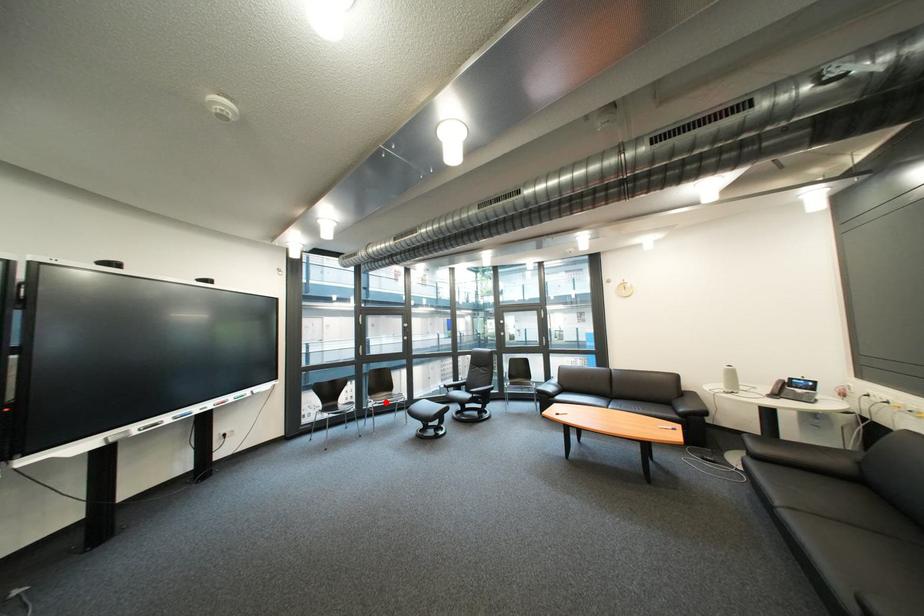
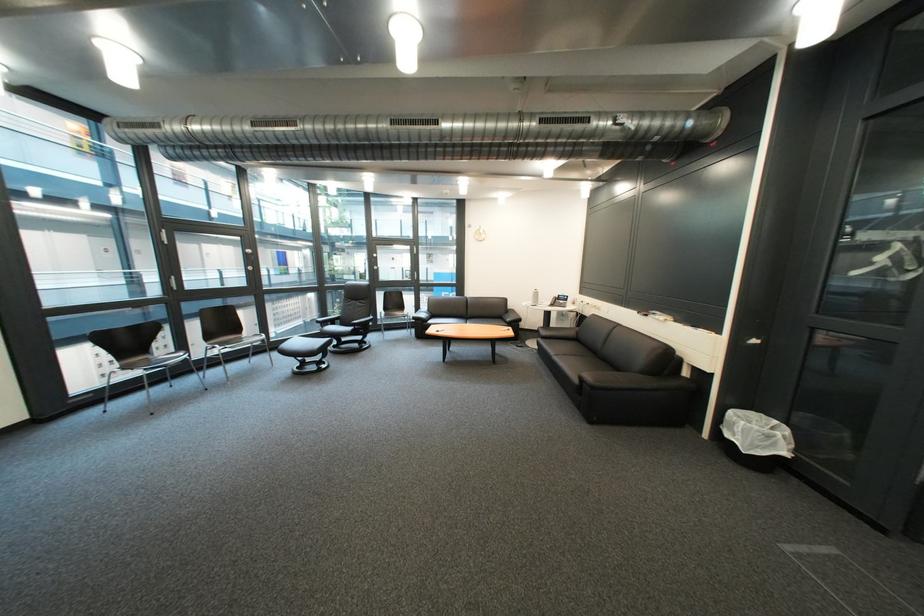
In the second image, find the point that corresponds to the highlighted location in the first image.

(229, 347)